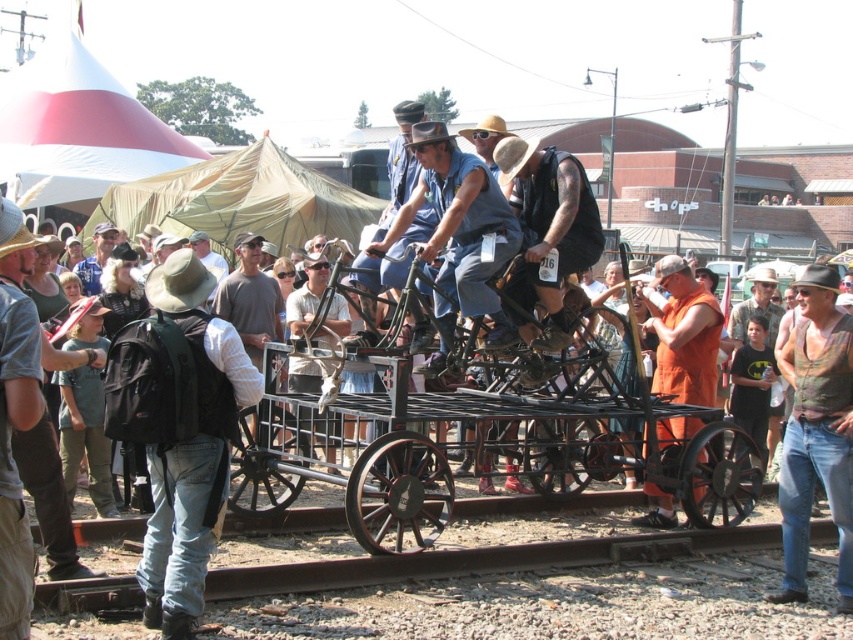
You are standing at the origin point of the coordinate system in the image. The brown canvas backpack at left is located at a coordinate point. Is the backpack to your left or right side?

The brown canvas backpack at left is located at coordinate point 0.655 on the x axis. Since the x axis increases from left to right, a higher value means it is further to the right. However, the backpack is labeled as being at the left, so there might be a discrepancy. But based on the coordinate given, 0.655 is to the right side of the image. Therefore, the backpack is to your right side.

You are a photographer at the fair and want to capture both the denim blue shirt at center and the metallic silver bicycle at center in a single photo. Which object should you position closer to the camera to ensure both are in focus?

To ensure both the denim blue shirt at center and the metallic silver bicycle at center are in focus, position the denim blue shirt at center closer to the camera since it is already in front of the metallic silver bicycle at center. This way, the depth of field will cover both subjects effectively.